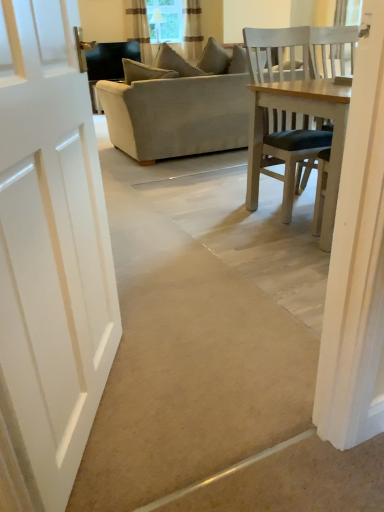
Question: From the image's perspective, would you say clear glass window screen at upper center is positioned over beige fabric couch at center?

Choices:
 (A) yes
 (B) no

Answer: (A)

Question: Is clear glass window screen at upper center at the right side of beige fabric couch at center?

Choices:
 (A) no
 (B) yes

Answer: (A)

Question: From the image's perspective, is clear glass window screen at upper center below beige fabric couch at center?

Choices:
 (A) no
 (B) yes

Answer: (A)

Question: From a real-world perspective, is clear glass window screen at upper center positioned under beige fabric couch at center based on gravity?

Choices:
 (A) yes
 (B) no

Answer: (B)

Question: Is clear glass window screen at upper center positioned with its back to beige fabric couch at center?

Choices:
 (A) no
 (B) yes

Answer: (A)

Question: Does point (185, 38) appear closer or farther from the camera than point (163, 31)?

Choices:
 (A) farther
 (B) closer

Answer: (B)

Question: From the image's perspective, relative to clear glass window screen at upper center, is striped fabric curtain at upper center, which ranks as the second curtain in left-to-right order, above or below?

Choices:
 (A) above
 (B) below

Answer: (B)

Question: Considering their positions, is striped fabric curtain at upper center, arranged as the 1th curtain when viewed from the right, located in front of or behind clear glass window screen at upper center?

Choices:
 (A) behind
 (B) front

Answer: (B)

Question: Would you say striped fabric curtain at upper center, arranged as the 1th curtain when viewed from the right, is inside or outside clear glass window screen at upper center?

Choices:
 (A) inside
 (B) outside

Answer: (B)

Question: From the image's perspective, is clear glass window screen at upper center above or below wooden chair at right?

Choices:
 (A) below
 (B) above

Answer: (B)

Question: From a real-world perspective, is clear glass window screen at upper center above or below wooden chair at right?

Choices:
 (A) below
 (B) above

Answer: (B)

Question: In terms of width, does clear glass window screen at upper center look wider or thinner when compared to wooden chair at right?

Choices:
 (A) thin
 (B) wide

Answer: (A)

Question: Is clear glass window screen at upper center to the left or to the right of wooden chair at right in the image?

Choices:
 (A) right
 (B) left

Answer: (B)

Question: From the image's perspective, is striped fabric curtain at upper center, arranged as the 1th curtain when viewed from the right, positioned above or below brown textured curtain at upper center, which ranks as the 1th curtain in left-to-right order?

Choices:
 (A) below
 (B) above

Answer: (B)

Question: Considering their positions, is striped fabric curtain at upper center, which ranks as the second curtain in left-to-right order, located in front of or behind brown textured curtain at upper center, the 2th curtain when ordered from right to left?

Choices:
 (A) front
 (B) behind

Answer: (B)